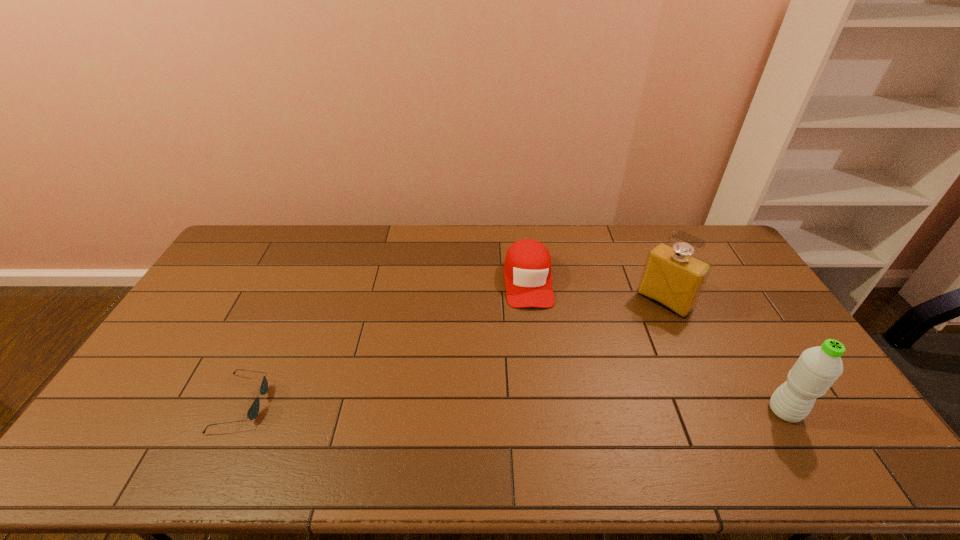
The width and height of the screenshot is (960, 540). I want to click on free spot at the near edge of the desktop, so click(x=455, y=406).

Where is `vacant region at the left edge of the desktop`? vacant region at the left edge of the desktop is located at coordinates (149, 371).

At what (x,y) coordinates should I click in order to perform the action: click on free space at the right edge. Please return your answer as a coordinate pair (x, y). Image resolution: width=960 pixels, height=540 pixels. Looking at the image, I should click on (775, 363).

You are a GUI agent. You are given a task and a screenshot of the screen. Output one action in this format:
    pyautogui.click(x=<x>, y=<y>)
    Task: Click on the vacant space that is in between the third tallest object and the rightmost object
    
    Given the screenshot: What is the action you would take?
    pyautogui.click(x=657, y=346)

I want to click on vacant area that lies between the second object from right to left and the leftmost object, so click(x=453, y=352).

Find the location of `vacant area between the water bottle and the baseball cap`. vacant area between the water bottle and the baseball cap is located at coordinates (657, 346).

Identify the location of free space that is in between the perfume and the water bottle. This screenshot has height=540, width=960. (725, 356).

Locate an element on the screen. Image resolution: width=960 pixels, height=540 pixels. free space between the baseball cap and the shortest object is located at coordinates (385, 342).

The width and height of the screenshot is (960, 540). Identify the location of vacant point located between the rightmost object and the perfume. (725, 356).

Image resolution: width=960 pixels, height=540 pixels. Find the location of `free area in between the baseball cap and the shortest object`. free area in between the baseball cap and the shortest object is located at coordinates (385, 342).